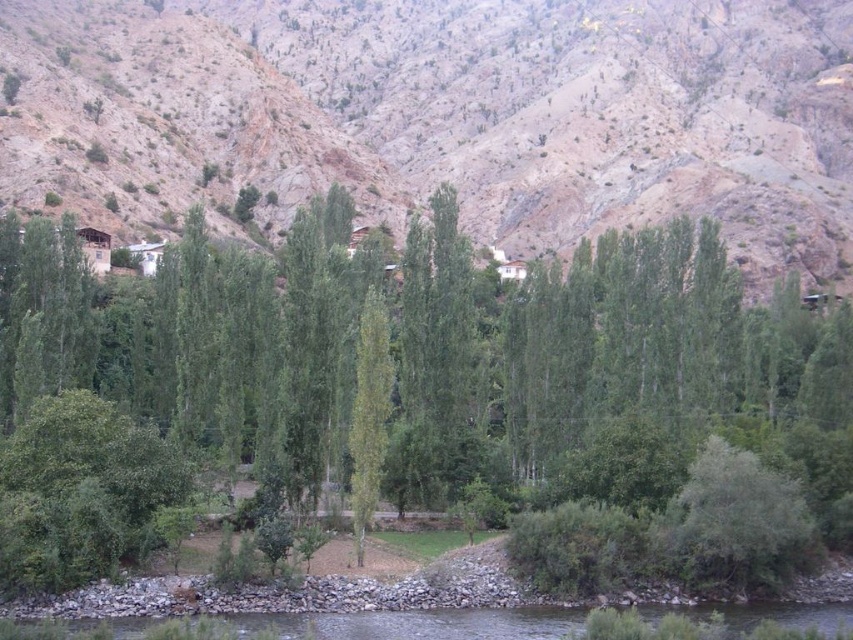
Question: Is green leafy tree at center wider than clear water at lower center?

Choices:
 (A) yes
 (B) no

Answer: (A)

Question: Where is dull brown rock at upper center located in relation to clear water at lower center in the image?

Choices:
 (A) above
 (B) below

Answer: (A)

Question: In this image, where is dull brown rock at upper center located relative to green smooth tree at center?

Choices:
 (A) left
 (B) right

Answer: (B)

Question: Which point is farther from the camera taking this photo?

Choices:
 (A) (293, 630)
 (B) (440, 208)

Answer: (B)

Question: Estimate the real-world distances between objects in this image. Which object is farther from the clear water at lower center?

Choices:
 (A) dull brown rock at upper center
 (B) green smooth tree at center
 (C) green leafy tree at center

Answer: (A)

Question: Which object appears farthest from the camera in this image?

Choices:
 (A) clear water at lower center
 (B) green leafy tree at center
 (C) dull brown rock at upper center
 (D) green smooth tree at center

Answer: (C)